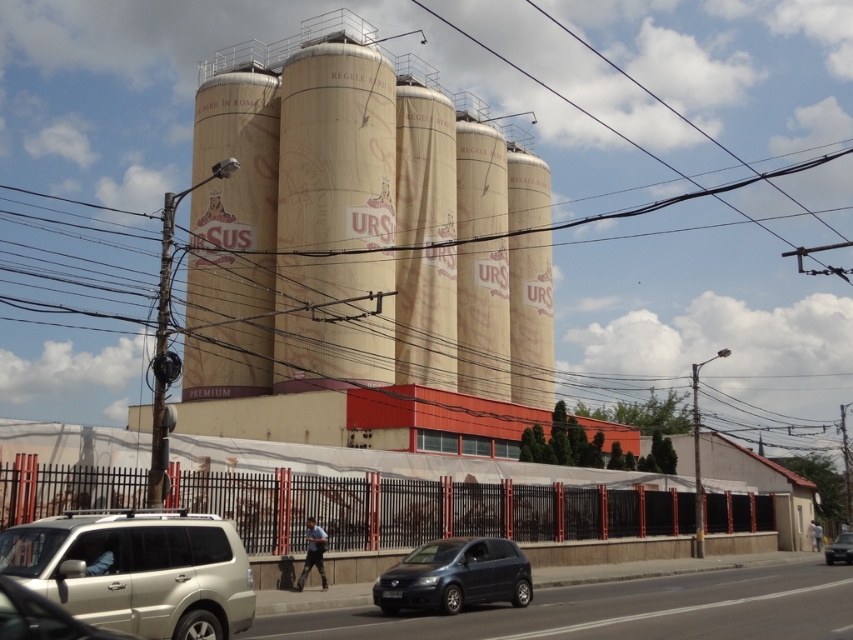
Does gold metallic suv at lower left have a lesser width compared to matte black car at lower center?

Yes, gold metallic suv at lower left is thinner than matte black car at lower center.

Can you confirm if gold metallic suv at lower left is wider than matte black car at lower center?

In fact, gold metallic suv at lower left might be narrower than matte black car at lower center.

Where is `gold metallic suv at lower left`? The image size is (853, 640). gold metallic suv at lower left is located at coordinates (137, 570).

Locate an element on the screen. The image size is (853, 640). gold metallic suv at lower left is located at coordinates [x=137, y=570].

Does point (91, 516) come closer to viewer compared to point (844, 534)?

Yes, it is.

Which of these two, gold metallic suv at lower left or matte black car at lower right, stands taller?

matte black car at lower right

In order to click on gold metallic suv at lower left in this screenshot , I will do `click(137, 570)`.

Is metallic silver suv at lower left to the left of matte black car at lower right from the viewer's perspective?

Indeed, metallic silver suv at lower left is positioned on the left side of matte black car at lower right.

Is metallic silver suv at lower left bigger than matte black car at lower right?

No, metallic silver suv at lower left is not bigger than matte black car at lower right.

The image size is (853, 640). What do you see at coordinates (41, 618) in the screenshot? I see `metallic silver suv at lower left` at bounding box center [41, 618].

Find the location of a particular element. The height and width of the screenshot is (640, 853). metallic silver suv at lower left is located at coordinates (41, 618).